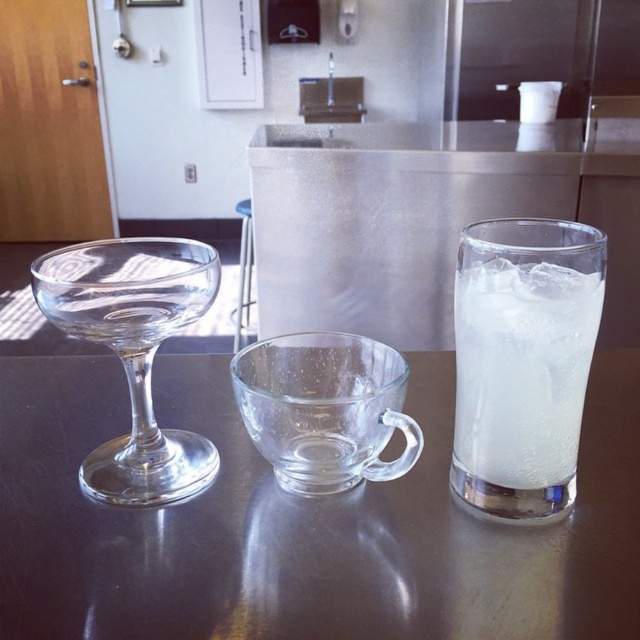
Image resolution: width=640 pixels, height=640 pixels. Describe the element at coordinates (522, 369) in the screenshot. I see `clear glass at right` at that location.

Is point (461, 337) closer to camera compared to point (88, 248)?

That is True.

Locate an element on the screen. clear glass at right is located at coordinates (522, 369).

Which is below, transparent glass table at center or transparent glass wine glass at left?

transparent glass table at center is lower down.

Who is more forward, (252,588) or (161,280)?

Point (252,588)

The image size is (640, 640). In order to click on transparent glass table at center in this screenshot , I will do `click(300, 524)`.

Does point (541, 278) come behind point (369, 356)?

No, it is not.

Which of these two, clear glass at right or transparent glass cup at center, stands taller?

With more height is clear glass at right.

Does point (483, 474) come farther from viewer compared to point (248, 419)?

Yes.

Identify the location of clear glass at right. (522, 369).